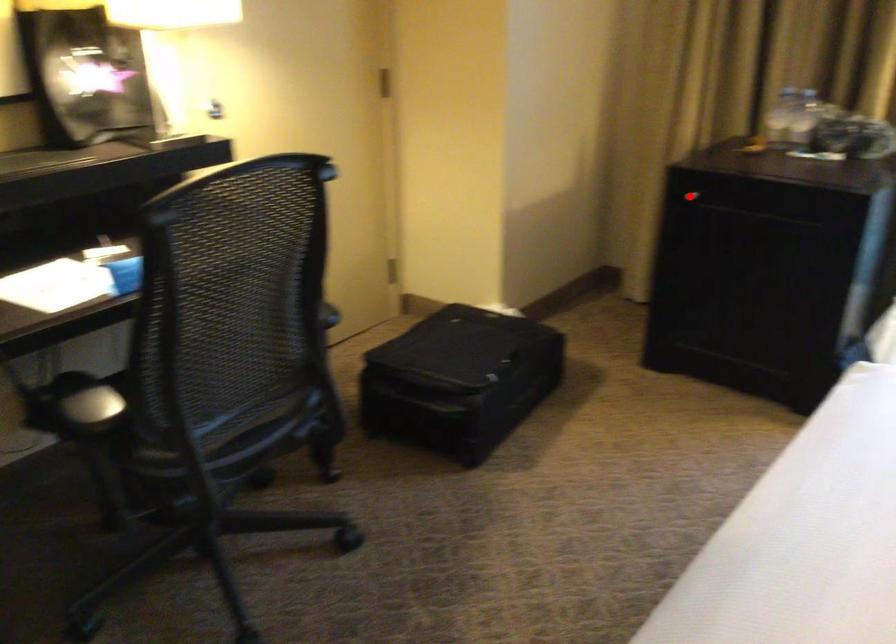
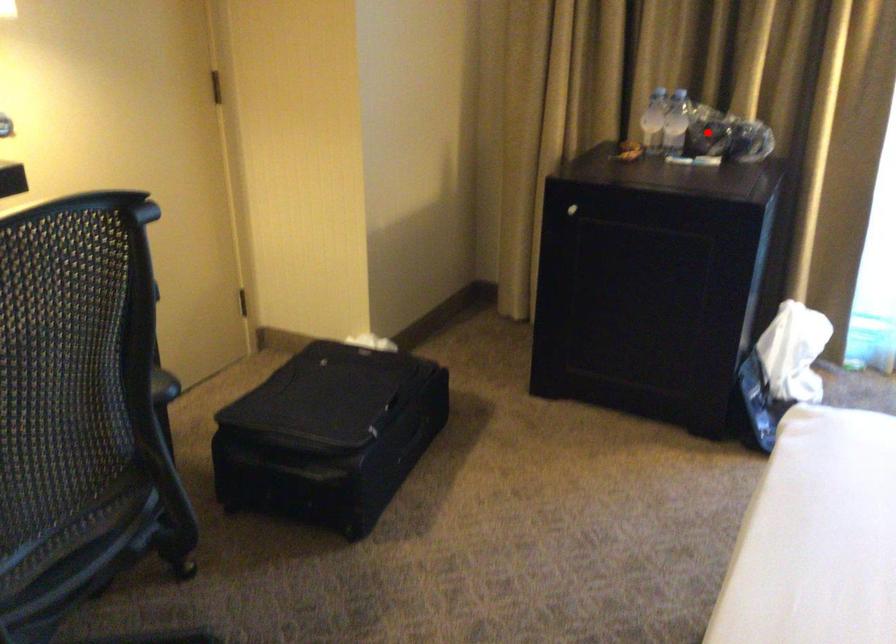
I am providing you with two images of the same scene from different viewpoints. A red point is marked on the first image and another point is marked on the second image. Do the highlighted points in image1 and image2 indicate the same real-world spot?

No